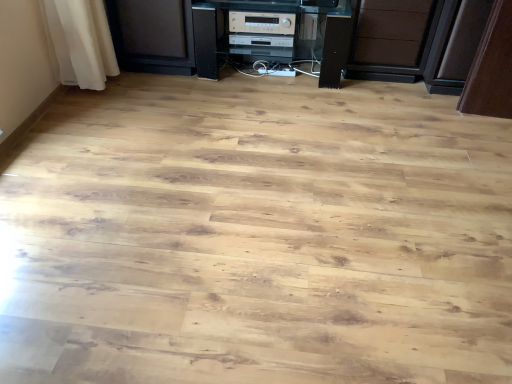
Describe the element at coordinates (262, 23) in the screenshot. I see `silver metallic stereo at center, acting as the 1th appliance starting from the front` at that location.

Image resolution: width=512 pixels, height=384 pixels. Find the location of `silver metallic stereo at center, acting as the 1th appliance starting from the front`. silver metallic stereo at center, acting as the 1th appliance starting from the front is located at coordinates (262, 23).

Is brown matte drawer at center touching black plastic stereo at center?

No, brown matte drawer at center is not touching black plastic stereo at center.

From a real-world perspective, is brown matte drawer at center physically located above or below black plastic stereo at center?

In terms of real-world spatial position, brown matte drawer at center is above black plastic stereo at center.

Is brown matte drawer at center turned away from black plastic stereo at center?

No, brown matte drawer at center's orientation is not away from black plastic stereo at center.

From the image's perspective, is brown matte drawer at center below black plastic stereo at center?

Actually, brown matte drawer at center appears above black plastic stereo at center in the image.

Between point (282, 12) and point (387, 37), which one is positioned in front?

The point (282, 12) is closer to the camera.

How different are the orientations of black plastic stereo at center and brown matte drawer at center in degrees?

The angle between the facing direction of black plastic stereo at center and the facing direction of brown matte drawer at center is 1.81 degrees.

From a real-world perspective, relative to brown matte drawer at center, is black plastic stereo at center vertically above or below?

black plastic stereo at center is below brown matte drawer at center.

Does black plastic stereo at center have a greater width compared to brown matte drawer at center?

Indeed, black plastic stereo at center has a greater width compared to brown matte drawer at center.

Is point (262, 31) closer or farther from the camera than point (255, 28)?

Point (262, 31) is positioned farther from the camera compared to point (255, 28).

Which object is positioned more to the right, silver metallic stereo at center, the second appliance in the front-to-back sequence, or silver metallic stereo at center, the second appliance viewed from the back?

silver metallic stereo at center, the second appliance viewed from the back, is more to the right.

Between silver metallic stereo at center, the second appliance in the front-to-back sequence, and silver metallic stereo at center, the second appliance viewed from the back, which one has less height?

→ silver metallic stereo at center, the second appliance in the front-to-back sequence, is shorter.

From the image's perspective, is brown matte drawer at center located beneath silver metallic stereo at center, acting as the 1th appliance starting from the front?

Indeed, from the image's perspective, brown matte drawer at center is shown beneath silver metallic stereo at center, acting as the 1th appliance starting from the front.

Is brown matte drawer at center inside or outside of silver metallic stereo at center, the second appliance viewed from the back?

brown matte drawer at center cannot be found inside silver metallic stereo at center, the second appliance viewed from the back.

Which object is wider, brown matte drawer at center or silver metallic stereo at center, the second appliance viewed from the back?

brown matte drawer at center is wider.

Is brown matte drawer at center next to silver metallic stereo at center, acting as the 1th appliance starting from the front?

No, brown matte drawer at center is not beside silver metallic stereo at center, acting as the 1th appliance starting from the front.

From a real-world perspective, is silver metallic stereo at center, the second appliance in the front-to-back sequence, beneath brown matte drawer at center?

Correct, in the physical world, silver metallic stereo at center, the second appliance in the front-to-back sequence, is lower than brown matte drawer at center.

Is silver metallic stereo at center, positioned as the first appliance in back-to-front order, shorter than brown matte drawer at center?

Correct, silver metallic stereo at center, positioned as the first appliance in back-to-front order, is not as tall as brown matte drawer at center.

Is silver metallic stereo at center, positioned as the first appliance in back-to-front order, facing towards brown matte drawer at center?

No, silver metallic stereo at center, positioned as the first appliance in back-to-front order, is not turned towards brown matte drawer at center.

You are a GUI agent. You are given a task and a screenshot of the screen. Output one action in this format:
    pyautogui.click(x=<x>, y=<y>)
    Task: Click on the 2nd appliance behind the brown matte drawer at center
    
    Given the screenshot: What is the action you would take?
    pyautogui.click(x=262, y=34)

Could black plastic stereo at center be considered to be inside silver metallic stereo at center, the second appliance viewed from the back?

No, black plastic stereo at center is not surrounded by silver metallic stereo at center, the second appliance viewed from the back.

Considering the sizes of silver metallic stereo at center, the second appliance viewed from the back, and black plastic stereo at center in the image, is silver metallic stereo at center, the second appliance viewed from the back, taller or shorter than black plastic stereo at center?

Clearly, silver metallic stereo at center, the second appliance viewed from the back, is shorter compared to black plastic stereo at center.

Does point (267, 19) appear closer or farther from the camera than point (302, 32)?

Point (267, 19) is closer to the camera than point (302, 32).

Which is more to the right, silver metallic stereo at center, acting as the 1th appliance starting from the front, or black plastic stereo at center?

Positioned to the right is black plastic stereo at center.

From a real-world perspective, which appliance is the 1st one above the black plastic stereo at center? Please provide its 2D coordinates.

[(262, 34)]

Can you confirm if silver metallic stereo at center, the second appliance in the front-to-back sequence, is thinner than black plastic stereo at center?

Correct, the width of silver metallic stereo at center, the second appliance in the front-to-back sequence, is less than that of black plastic stereo at center.

Who is taller, silver metallic stereo at center, positioned as the first appliance in back-to-front order, or black plastic stereo at center?

black plastic stereo at center is taller.

From the image's perspective, relative to black plastic stereo at center, is silver metallic stereo at center, the second appliance in the front-to-back sequence, above or below?

Based on their image positions, silver metallic stereo at center, the second appliance in the front-to-back sequence, is located above black plastic stereo at center.

Locate an element on the screen. This screenshot has width=512, height=384. drawer located on the right of black plastic stereo at center is located at coordinates (391, 33).

This screenshot has height=384, width=512. What are the coordinates of `furniture located below the brown matte drawer at center (from the image's perspective)` in the screenshot? It's located at (273, 34).

Based on their spatial positions, is black plastic stereo at center or silver metallic stereo at center, the second appliance viewed from the back, closer to brown matte drawer at center?

Among the two, black plastic stereo at center is located nearer to brown matte drawer at center.

Estimate the real-world distances between objects in this image. Which object is further from silver metallic stereo at center, positioned as the first appliance in back-to-front order, silver metallic stereo at center, acting as the 1th appliance starting from the front, or brown matte drawer at center?

The object further to silver metallic stereo at center, positioned as the first appliance in back-to-front order, is brown matte drawer at center.

When comparing their distances from brown matte drawer at center, does silver metallic stereo at center, the second appliance viewed from the back, or black plastic stereo at center seem closer?

black plastic stereo at center lies closer to brown matte drawer at center than the other object.

Which object lies further to the anchor point black plastic stereo at center, silver metallic stereo at center, the second appliance viewed from the back, or silver metallic stereo at center, the second appliance in the front-to-back sequence?

silver metallic stereo at center, the second appliance viewed from the back, is positioned further to the anchor black plastic stereo at center.

Looking at the image, which one is located closer to silver metallic stereo at center, the second appliance viewed from the back, silver metallic stereo at center, the second appliance in the front-to-back sequence, or brown matte drawer at center?

silver metallic stereo at center, the second appliance in the front-to-back sequence, is positioned closer to the anchor silver metallic stereo at center, the second appliance viewed from the back.

Considering their positions, is black plastic stereo at center positioned further to brown matte drawer at center than silver metallic stereo at center, the second appliance in the front-to-back sequence?

Among the two, silver metallic stereo at center, the second appliance in the front-to-back sequence, is located further to brown matte drawer at center.

Consider the image. Looking at the image, which one is located further to silver metallic stereo at center, positioned as the first appliance in back-to-front order, brown matte drawer at center or silver metallic stereo at center, the second appliance viewed from the back?

brown matte drawer at center.

Which object lies further to the anchor point brown matte drawer at center, silver metallic stereo at center, the second appliance in the front-to-back sequence, or black plastic stereo at center?

silver metallic stereo at center, the second appliance in the front-to-back sequence.

Where is `appliance between black plastic stereo at center and silver metallic stereo at center, positioned as the first appliance in back-to-front order, from front to back`? The width and height of the screenshot is (512, 384). appliance between black plastic stereo at center and silver metallic stereo at center, positioned as the first appliance in back-to-front order, from front to back is located at coordinates (262, 23).

Locate an element on the screen. Image resolution: width=512 pixels, height=384 pixels. appliance located between silver metallic stereo at center, the second appliance in the front-to-back sequence, and brown matte drawer at center in the left-right direction is located at coordinates (262, 23).

You are a GUI agent. You are given a task and a screenshot of the screen. Output one action in this format:
    pyautogui.click(x=<x>, y=<y>)
    Task: Click on the furniture between silver metallic stereo at center, acting as the 1th appliance starting from the front, and brown matte drawer at center from left to right
    
    Given the screenshot: What is the action you would take?
    pyautogui.click(x=273, y=34)

I want to click on furniture between silver metallic stereo at center, positioned as the first appliance in back-to-front order, and brown matte drawer at center from left to right, so click(273, 34).